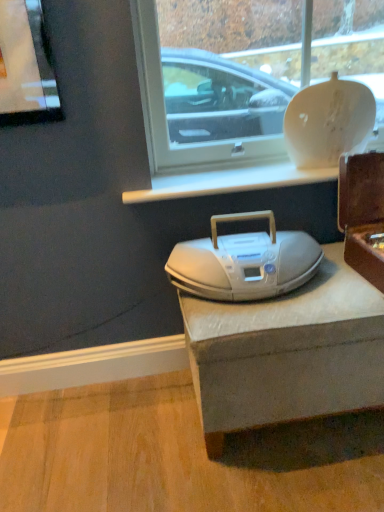
Question: Considering the positions of brown wooden box at right and white glossy vase at upper center in the image, is brown wooden box at right taller or shorter than white glossy vase at upper center?

Choices:
 (A) tall
 (B) short

Answer: (B)

Question: From the image's perspective, is brown wooden box at right located above or below white glossy vase at upper center?

Choices:
 (A) below
 (B) above

Answer: (A)

Question: Which is nearer to the white glossy vase at upper center?

Choices:
 (A) white plastic boombox at center
 (B) brown wooden box at right

Answer: (B)

Question: Which is nearer to the white plastic boombox at center?

Choices:
 (A) brown wooden box at right
 (B) white glossy vase at upper center

Answer: (A)